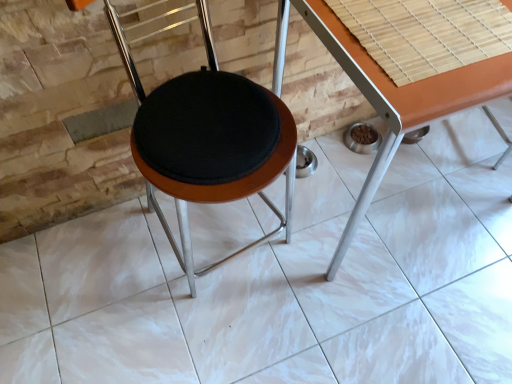
At what (x,y) coordinates should I click in order to perform the action: click on free space underneath orange laminate table at center (from a real-world perspective). Please return your answer as a coordinate pair (x, y). This screenshot has width=512, height=384. Looking at the image, I should click on (386, 193).